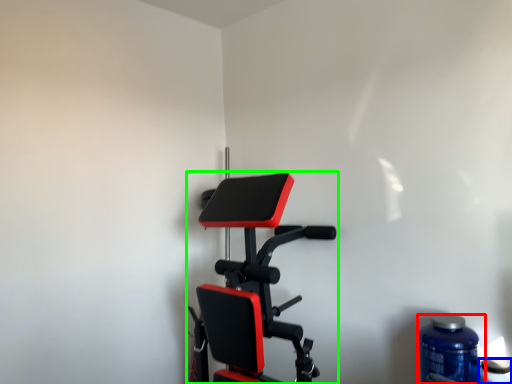
Question: Which is farther away from bottle (highlighted by a red box)? bottle (highlighted by a blue box) or stationary bicycle (highlighted by a green box)?

Choices:
 (A) bottle
 (B) stationary bicycle

Answer: (B)